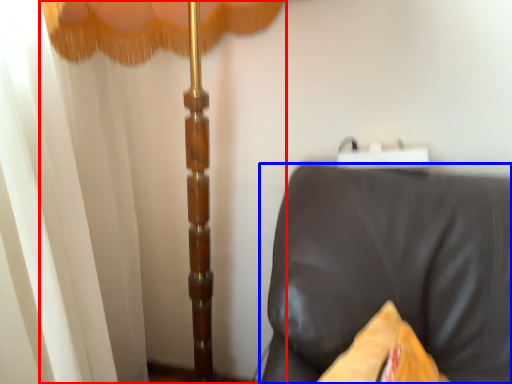
Question: Which object is further to the camera taking this photo, curtain (highlighted by a red box) or furniture (highlighted by a blue box)?

Choices:
 (A) curtain
 (B) furniture

Answer: (A)